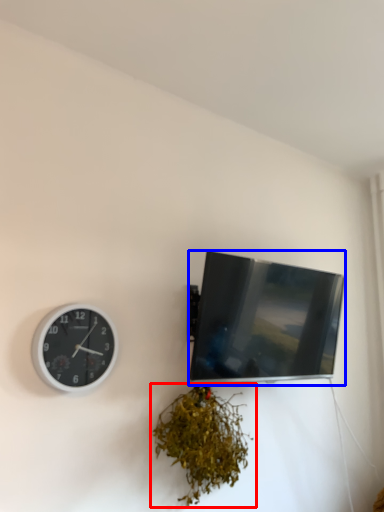
Question: Which object is closer to the camera taking this photo, houseplant (highlighted by a red box) or television (highlighted by a blue box)?

Choices:
 (A) houseplant
 (B) television

Answer: (A)